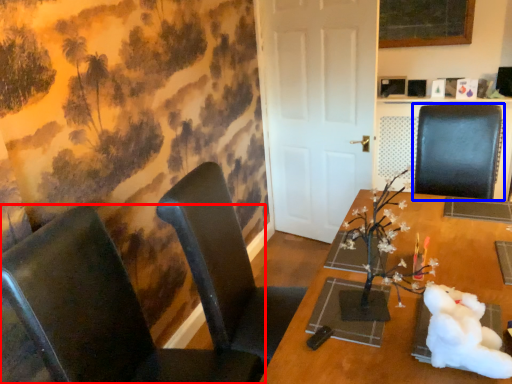
Question: Which object appears closest to the camera in this image, chair (highlighted by a red box) or chair (highlighted by a blue box)?

Choices:
 (A) chair
 (B) chair

Answer: (A)